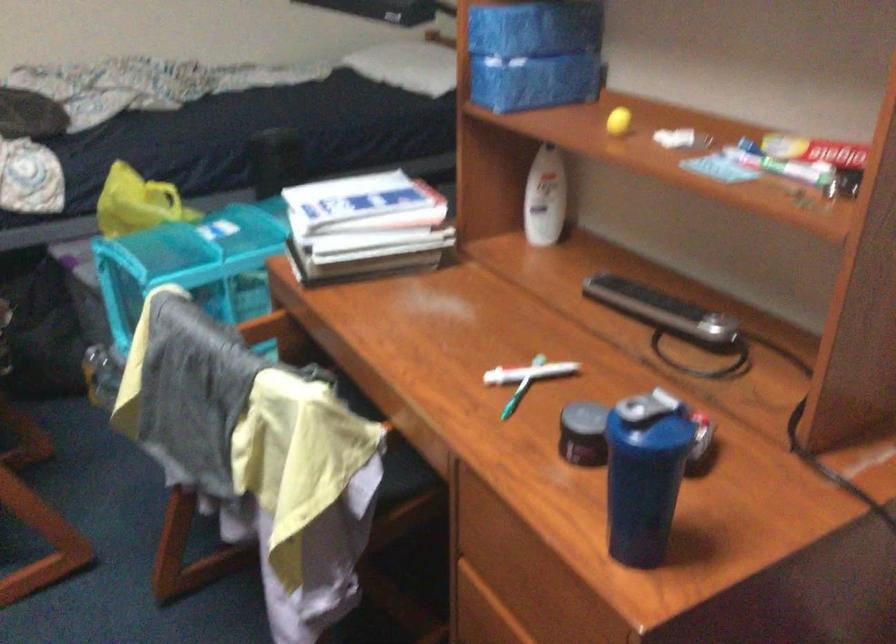
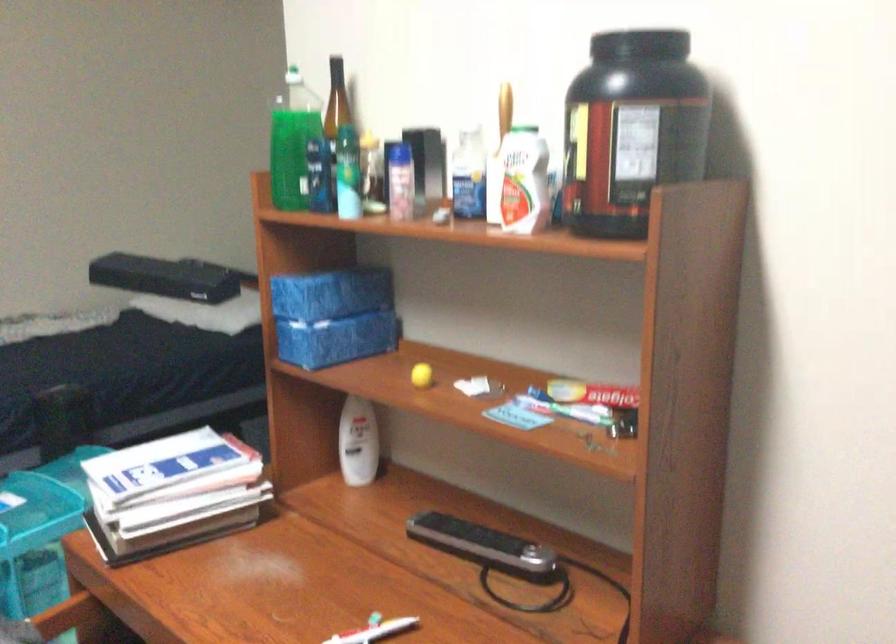
What movement of the cameraman would produce the second image?

The movement direction of the cameraman is left, backward.